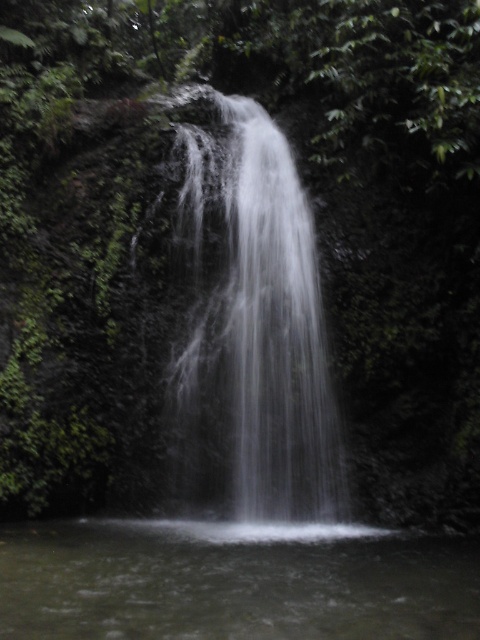
Does white frothy water at center appear under clear water at center?

Actually, white frothy water at center is above clear water at center.

Is white frothy water at center to the right of clear water at center from the viewer's perspective?

Indeed, white frothy water at center is positioned on the right side of clear water at center.

Between point (207, 499) and point (336, 579), which one is positioned behind?

The point (207, 499) is behind.

At what (x,y) coordinates should I click in order to perform the action: click on white frothy water at center. Please return your answer as a coordinate pair (x, y). The height and width of the screenshot is (640, 480). Looking at the image, I should click on (252, 332).